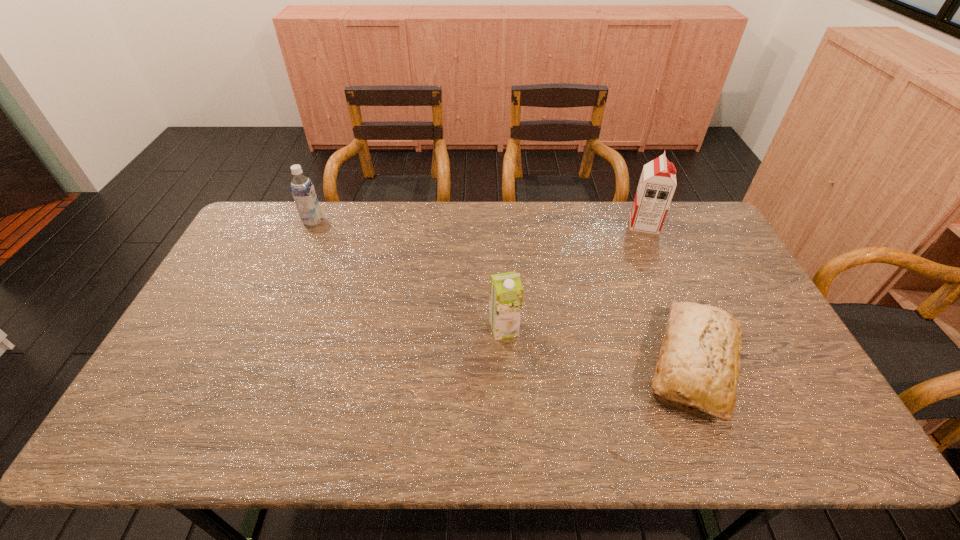
The image size is (960, 540). Find the location of `the tallest object`. the tallest object is located at coordinates (657, 184).

Where is `the tallest soya milk`? the tallest soya milk is located at coordinates (657, 184).

Identify the location of the leftmost soya milk. The height and width of the screenshot is (540, 960). (302, 188).

Where is `the second soya milk from right to left`? the second soya milk from right to left is located at coordinates (506, 291).

Identify the location of the nearest soya milk. The height and width of the screenshot is (540, 960). (506, 291).

Image resolution: width=960 pixels, height=540 pixels. Find the location of `the shortest object`. the shortest object is located at coordinates (699, 358).

You are a GUI agent. You are given a task and a screenshot of the screen. Output one action in this format:
    pyautogui.click(x=<x>, y=<y>)
    Task: Click on the free location located on the front of the rightmost soya milk
    This screenshot has height=540, width=960.
    Given the screenshot: What is the action you would take?
    pyautogui.click(x=660, y=260)

Where is `free space located 0.130m on the label of the leftmost soya milk`? The height and width of the screenshot is (540, 960). free space located 0.130m on the label of the leftmost soya milk is located at coordinates (359, 221).

Locate an element on the screen. The height and width of the screenshot is (540, 960). vacant space positioned on the right of the second object from left to right is located at coordinates (622, 329).

Find the location of a particular element. The image size is (960, 540). vacant region located on the left of the shortest object is located at coordinates coord(610,366).